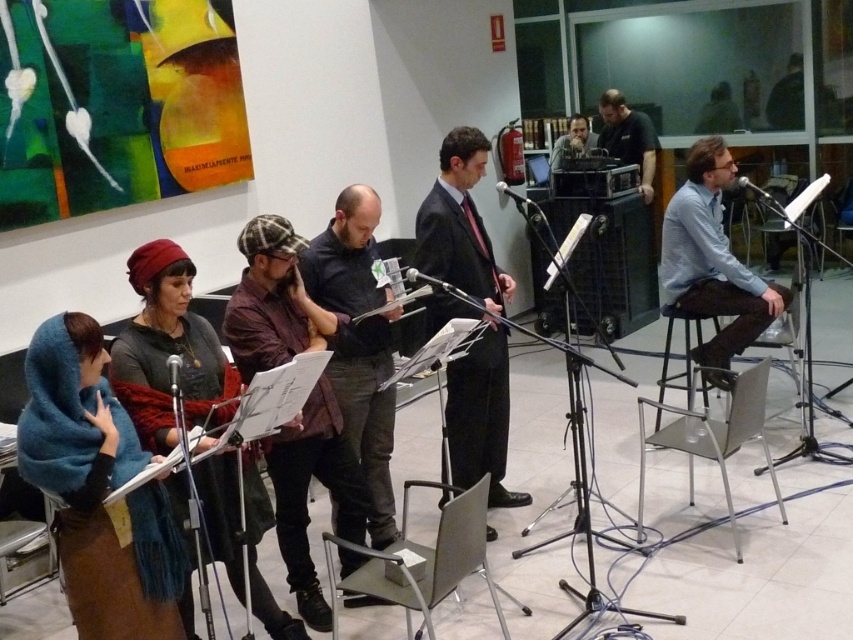
You are a photographer setting up for a group photo. You need to decide which person to place in the center based on their clothing size. Which person should you choose between the blue shirt at center and the dark green shirt at upper right?

The blue shirt at center has a larger width than the dark green shirt at upper right, so you should choose the blue shirt at center to place in the center as it is wider.

You are standing in the room and want to place a small table at the point marked as point (505, 424). The table requires 4 meters of space from the camera to be placed safely. Is the distance sufficient?

The distance of point (505, 424) from the camera is 4.29 meters, which is more than the required 4 meters, so the table can be placed safely there.